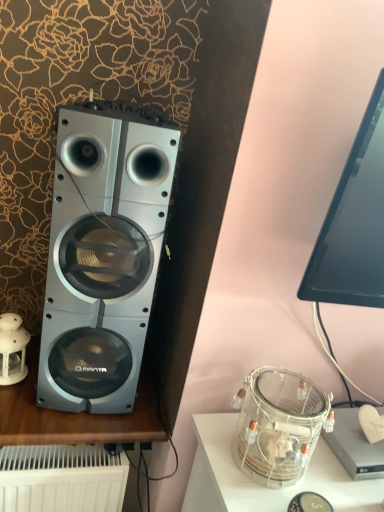
Question: Is silver metallic speaker at left thinner than black glossy monitor at upper right?

Choices:
 (A) no
 (B) yes

Answer: (A)

Question: Does silver metallic speaker at left touch black glossy monitor at upper right?

Choices:
 (A) no
 (B) yes

Answer: (A)

Question: Is silver metallic speaker at left closer to camera compared to black glossy monitor at upper right?

Choices:
 (A) no
 (B) yes

Answer: (A)

Question: From a real-world perspective, is silver metallic speaker at left under black glossy monitor at upper right?

Choices:
 (A) yes
 (B) no

Answer: (A)

Question: Is silver metallic speaker at left bigger than black glossy monitor at upper right?

Choices:
 (A) no
 (B) yes

Answer: (B)

Question: Considering the positions of black glossy monitor at upper right and clear glass jar at lower right in the image, is black glossy monitor at upper right taller or shorter than clear glass jar at lower right?

Choices:
 (A) short
 (B) tall

Answer: (A)

Question: Considering their positions, is black glossy monitor at upper right located in front of or behind clear glass jar at lower right?

Choices:
 (A) behind
 (B) front

Answer: (B)

Question: Choose the correct answer: Is black glossy monitor at upper right inside clear glass jar at lower right or outside it?

Choices:
 (A) inside
 (B) outside

Answer: (B)

Question: From a real-world perspective, is black glossy monitor at upper right positioned above or below clear glass jar at lower right?

Choices:
 (A) above
 (B) below

Answer: (A)

Question: From a real-world perspective, relative to clear glass jar at lower right, is clear glass jar at lower right vertically above or below?

Choices:
 (A) above
 (B) below

Answer: (A)

Question: Considering the positions of clear glass jar at lower right and clear glass jar at lower right in the image, is clear glass jar at lower right taller or shorter than clear glass jar at lower right?

Choices:
 (A) tall
 (B) short

Answer: (B)

Question: In the image, is clear glass jar at lower right positioned in front of or behind clear glass jar at lower right?

Choices:
 (A) behind
 (B) front

Answer: (A)

Question: Visually, is clear glass jar at lower right positioned to the left or to the right of clear glass jar at lower right?

Choices:
 (A) left
 (B) right

Answer: (A)

Question: From the image's perspective, is black glossy monitor at upper right located above or below silver metallic speaker at left?

Choices:
 (A) above
 (B) below

Answer: (A)

Question: Which is correct: black glossy monitor at upper right is inside silver metallic speaker at left, or outside of it?

Choices:
 (A) inside
 (B) outside

Answer: (B)